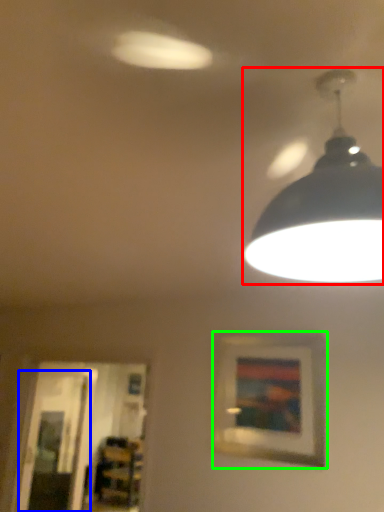
Question: Considering the real-world distances, which object is closest to lamp (highlighted by a red box)? glass door (highlighted by a blue box) or picture frame (highlighted by a green box).

Choices:
 (A) glass door
 (B) picture frame

Answer: (B)